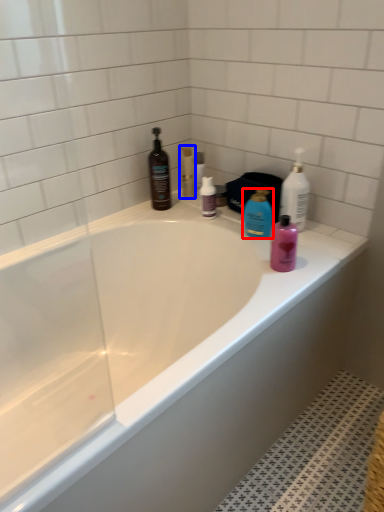
Question: Which point is further to the camera, cleaning product (highlighted by a red box) or toiletry (highlighted by a blue box)?

Choices:
 (A) cleaning product
 (B) toiletry

Answer: (B)